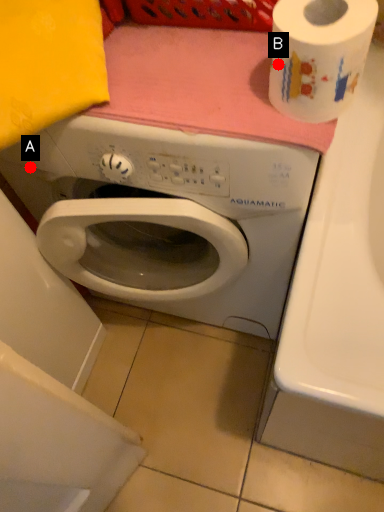
Question: Two points are circled on the image, labeled by A and B beside each circle. Which point is farther to the camera?

Choices:
 (A) A is further
 (B) B is further

Answer: (A)